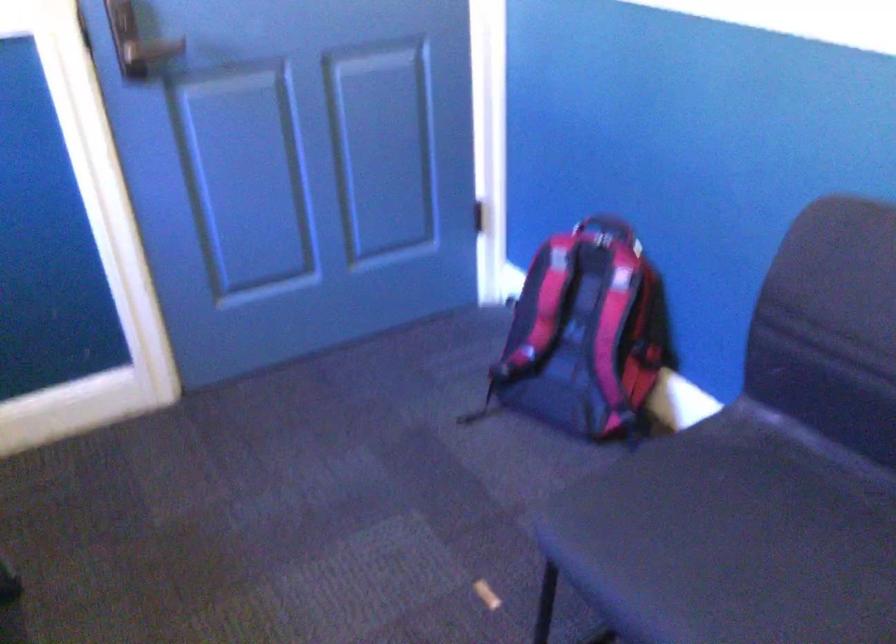
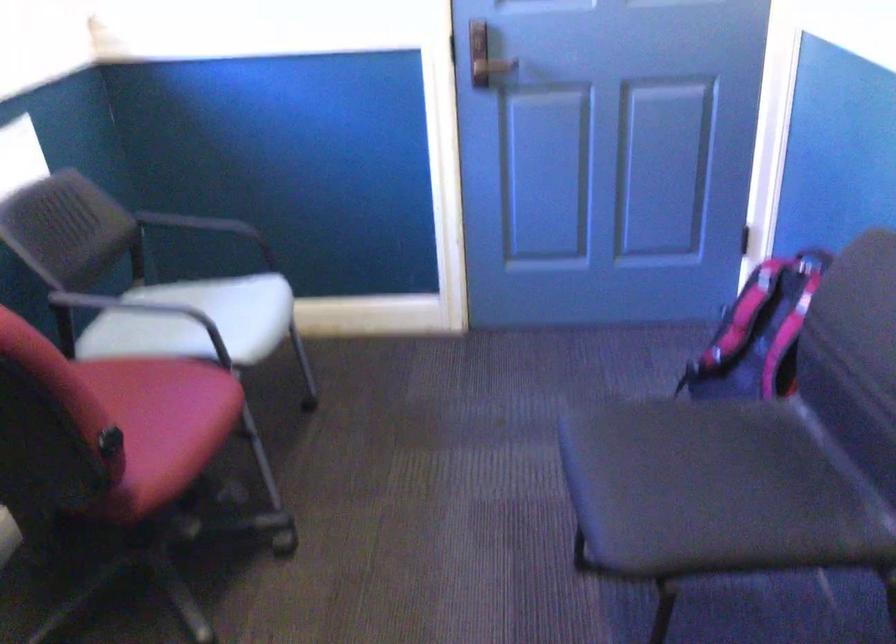
Where in the second image is the point corresponding to (x=572, y=317) from the first image?

(759, 333)